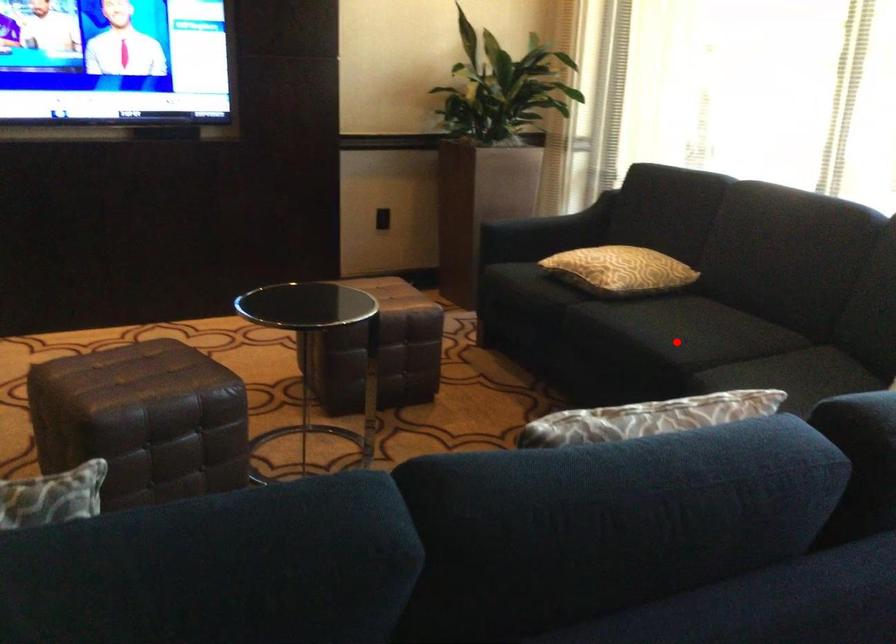
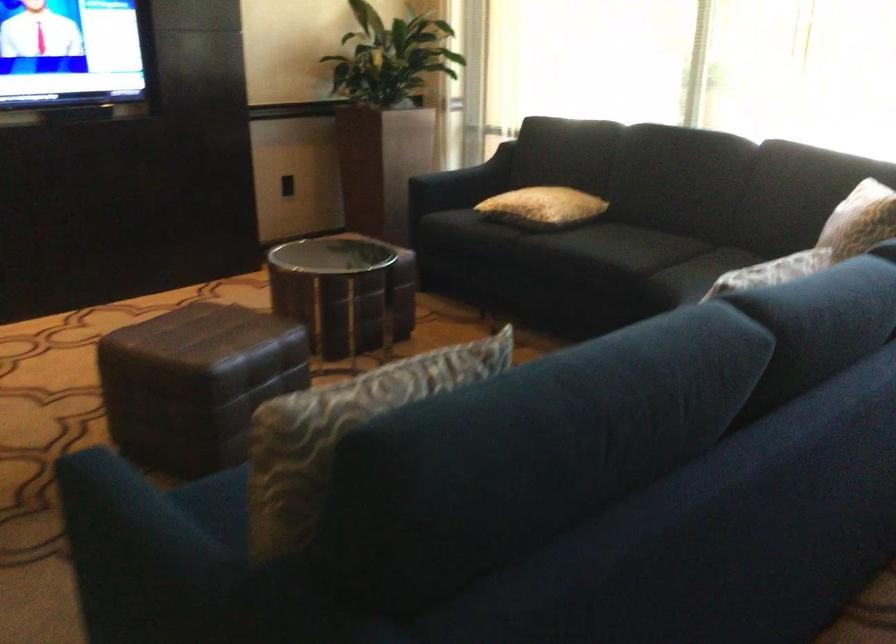
Where in the second image is the point corresponding to the highlighted location from the first image?

(626, 254)